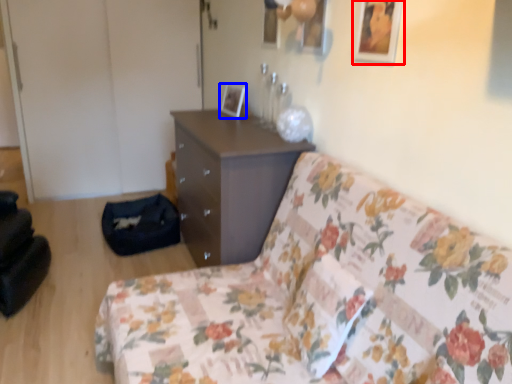
Question: Which object appears farthest to the camera in this image, picture frame (highlighted by a red box) or picture frame (highlighted by a blue box)?

Choices:
 (A) picture frame
 (B) picture frame

Answer: (B)